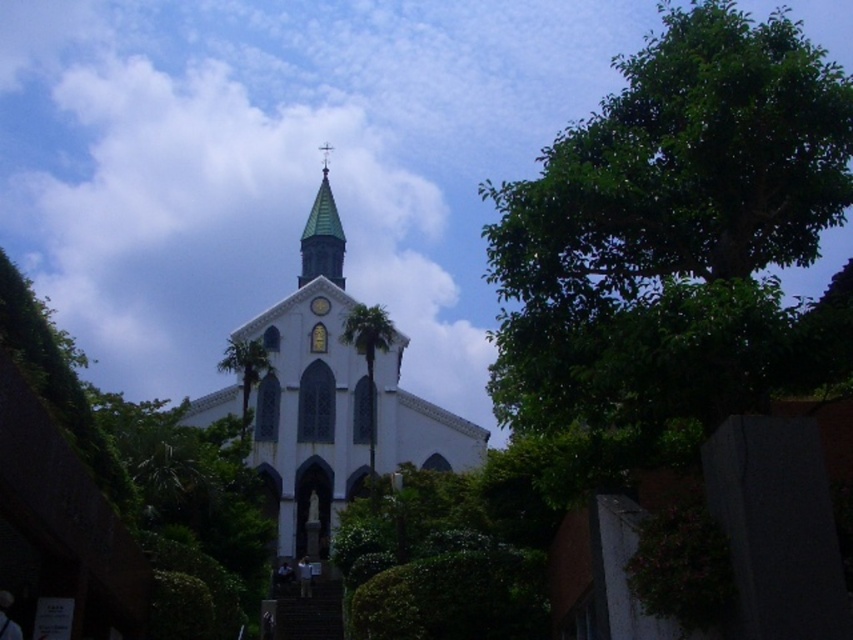
You are standing in front of the church and want to take a photo that includes both the green glazed steeple at center and the green leafy tree at center. Which object should you position to the left side of your camera frame to ensure both are visible?

You should position the green leafy tree at center to the left side of your camera frame because the green glazed steeple at center is to the right of the green leafy tree at center, so placing the tree on the left will allow the steeple to naturally appear on the right side of the frame, ensuring both are visible.

You are a drone operator trying to capture a photo of the church. Your drone has a camera with a 100mm lens that can focus on objects up to 10 meters away. The green glazed steeple at center and the green leafy tree at center are both in the frame. Which object will appear larger in the photo?

The green glazed steeple at center will appear larger in the photo because it is larger in size than the green leafy tree at center according to the description.